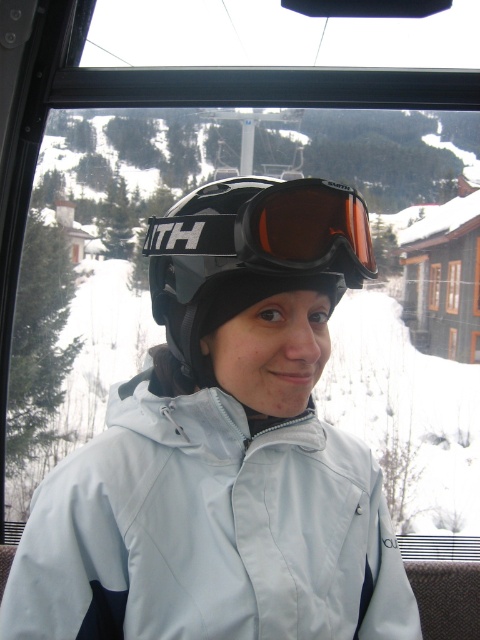
Locate an element on the screen. The width and height of the screenshot is (480, 640). light blue fabric jacket at center is located at coordinates (208, 529).

Between point (99, 502) and point (334, 188), which one is positioned in front?

Point (334, 188)

The height and width of the screenshot is (640, 480). In order to click on light blue fabric jacket at center in this screenshot , I will do `click(208, 529)`.

Between black matte helmet at center and matte orange lens at center, which one has less height?

matte orange lens at center is shorter.

Who is more distant from viewer, (360, 240) or (236, 225)?

The point (360, 240) is behind.

Locate an element on the screen. The width and height of the screenshot is (480, 640). black matte helmet at center is located at coordinates (250, 253).

Is point (179, 550) positioned before point (295, 230)?

That is False.

Which is behind, point (24, 541) or point (364, 253)?

Point (24, 541)

In order to click on light blue fabric jacket at center in this screenshot , I will do `click(208, 529)`.